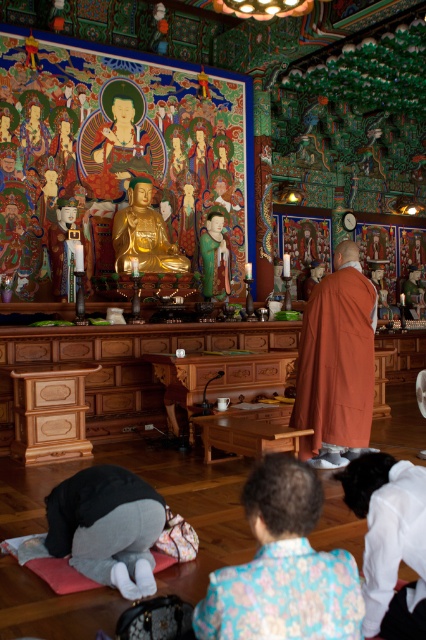
Question: Does floral silk robe at lower center have a lesser width compared to white matte robe at lower center?

Choices:
 (A) no
 (B) yes

Answer: (A)

Question: Is orange cotton robe at center above white matte robe at lower center?

Choices:
 (A) no
 (B) yes

Answer: (B)

Question: Which of the following is the farthest from the observer?

Choices:
 (A) (x=302, y=404)
 (B) (x=253, y=579)
 (C) (x=394, y=547)

Answer: (A)

Question: Which object is farther from the camera taking this photo?

Choices:
 (A) white matte robe at lower center
 (B) orange cotton robe at center
 (C) floral silk robe at lower center

Answer: (B)

Question: Which object is closer to the camera taking this photo?

Choices:
 (A) floral silk robe at lower center
 (B) white matte robe at lower center
 (C) orange cotton robe at center

Answer: (A)

Question: Does floral silk robe at lower center have a larger size compared to orange cotton robe at center?

Choices:
 (A) yes
 (B) no

Answer: (B)